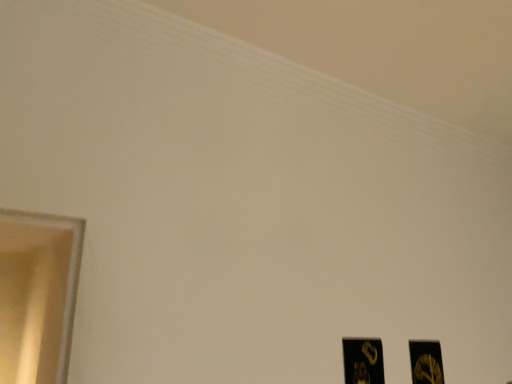
Question: Can you confirm if black matte picture frame at lower right, placed as the 1th picture frame when sorted from left to right, is thinner than black matte picture frame at lower right, the first picture frame from the right?

Choices:
 (A) yes
 (B) no

Answer: (A)

Question: Is black matte picture frame at lower right, the 2th picture frame positioned from the right, taller than black matte picture frame at lower right, the first picture frame from the right?

Choices:
 (A) no
 (B) yes

Answer: (B)

Question: From the image's perspective, is black matte picture frame at lower right, the 1th picture frame when ordered from front to back, over black matte picture frame at lower right, the first picture frame from the right?

Choices:
 (A) no
 (B) yes

Answer: (B)

Question: Is black matte picture frame at lower right, placed as the 1th picture frame when sorted from left to right, with black matte picture frame at lower right, which ranks as the first picture frame in back-to-front order?

Choices:
 (A) no
 (B) yes

Answer: (A)

Question: From the image's perspective, is black matte picture frame at lower right, the 1th picture frame when ordered from front to back, below black matte picture frame at lower right, the first picture frame from the right?

Choices:
 (A) yes
 (B) no

Answer: (B)

Question: Does black matte picture frame at lower right, the second picture frame viewed from the back, have a lesser height compared to black matte picture frame at lower right, placed as the 2th picture frame when sorted from front to back?

Choices:
 (A) yes
 (B) no

Answer: (B)

Question: Is black matte picture frame at lower right, which ranks as the first picture frame in back-to-front order, not within black matte picture frame at lower right, placed as the 1th picture frame when sorted from left to right?

Choices:
 (A) no
 (B) yes

Answer: (B)

Question: Would you say black matte picture frame at lower right, which ranks as the first picture frame in back-to-front order, is a long distance from black matte picture frame at lower right, the 2th picture frame positioned from the right?

Choices:
 (A) no
 (B) yes

Answer: (A)

Question: Is black matte picture frame at lower right, which ranks as the first picture frame in back-to-front order, oriented towards black matte picture frame at lower right, placed as the 1th picture frame when sorted from left to right?

Choices:
 (A) yes
 (B) no

Answer: (B)

Question: Does black matte picture frame at lower right, which ranks as the first picture frame in back-to-front order, appear on the right side of black matte picture frame at lower right, the 1th picture frame when ordered from front to back?

Choices:
 (A) yes
 (B) no

Answer: (A)

Question: Is black matte picture frame at lower right, which ranks as the first picture frame in back-to-front order, bigger than black matte picture frame at lower right, the second picture frame viewed from the back?

Choices:
 (A) yes
 (B) no

Answer: (A)

Question: Is the position of black matte picture frame at lower right, the second picture frame viewed from the left, less distant than that of black matte picture frame at lower right, placed as the 1th picture frame when sorted from left to right?

Choices:
 (A) yes
 (B) no

Answer: (B)

Question: In the image, is black matte picture frame at lower right, the first picture frame from the right, on the left side or the right side of black matte picture frame at lower right, the second picture frame viewed from the back?

Choices:
 (A) left
 (B) right

Answer: (B)